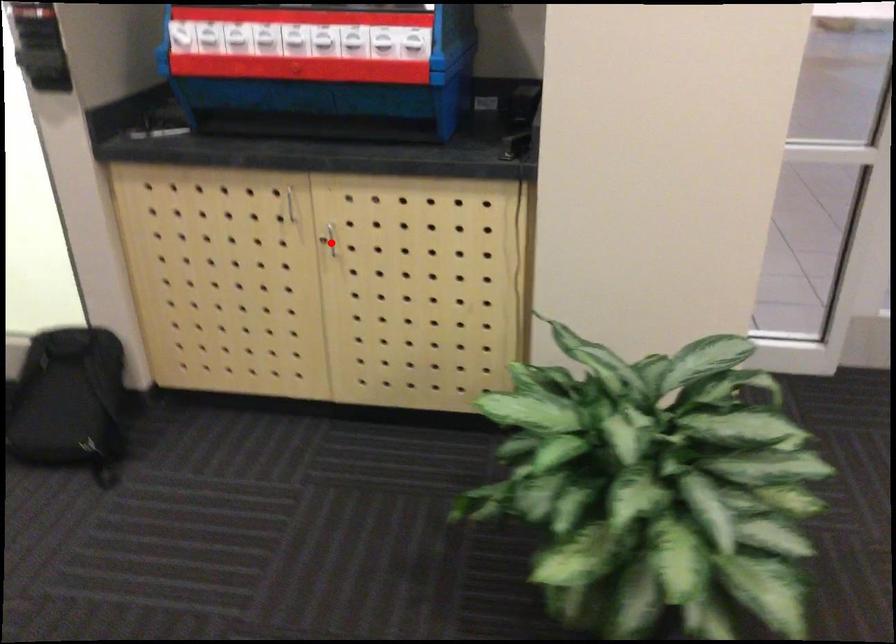
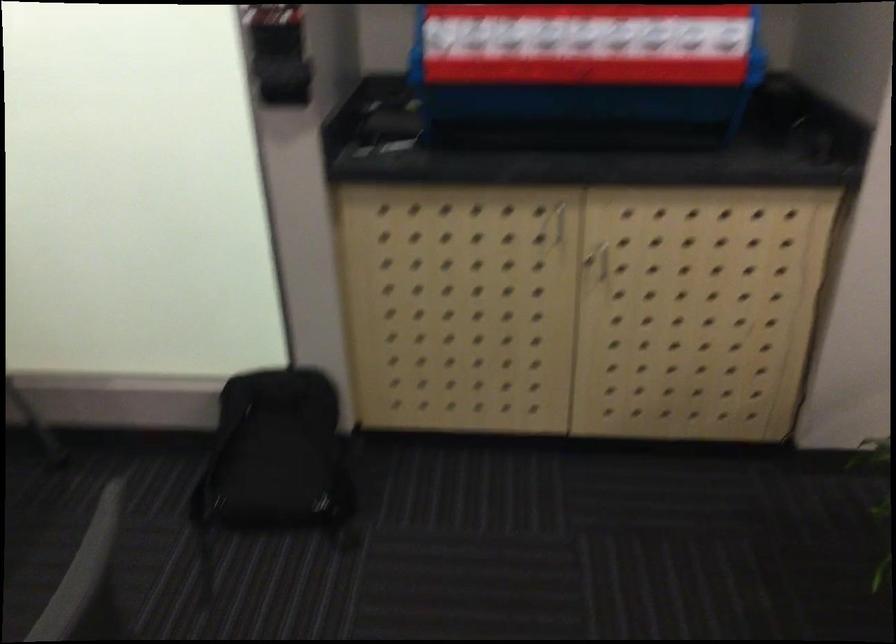
Question: I am providing you with two images of the same scene from different viewpoints. Given a red point in image1, look at the same physical point in image2. Is it:

Choices:
 (A) Closer to the viewpoint
 (B) Farther from the viewpoint

Answer: (A)